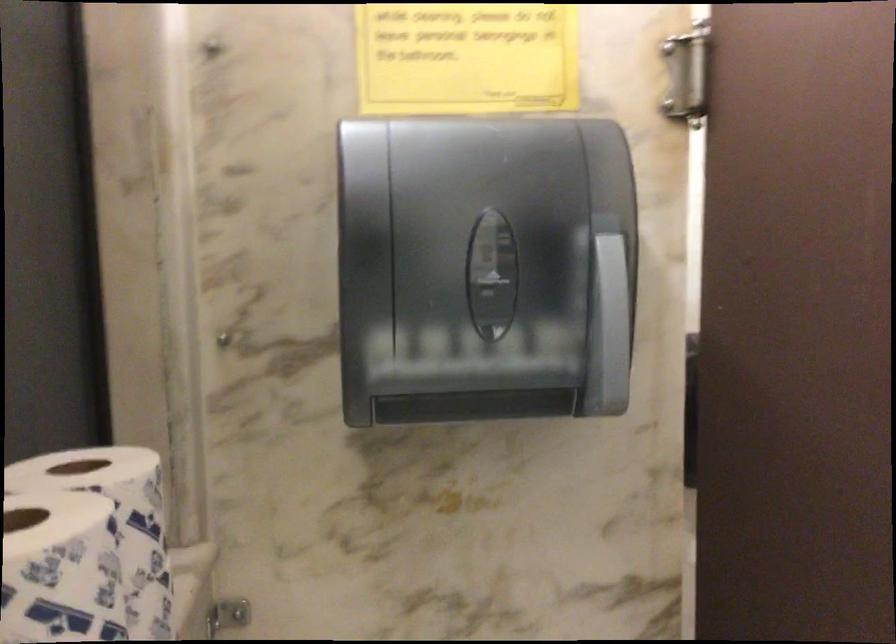
Where would you push the dispenser lever? Please return your answer as a coordinate pair (x, y).

(612, 251)